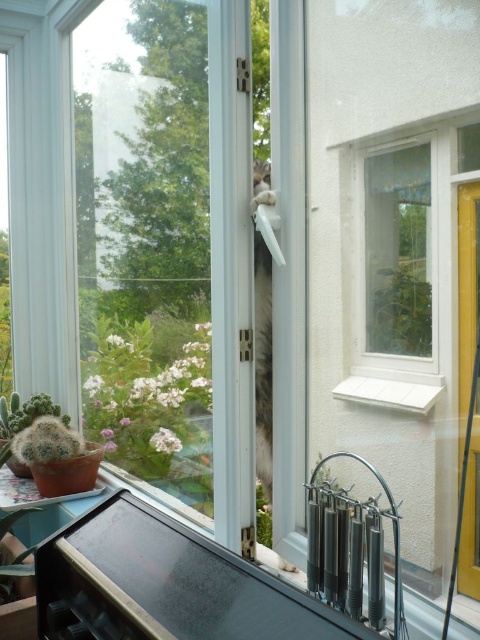
Question: Which point is farther to the camera?

Choices:
 (A) (2, 572)
 (B) (269, 509)

Answer: (B)

Question: From the image, what is the correct spatial relationship of yellow matte screen door at right in relation to green fuzzy cactus at lower left?

Choices:
 (A) below
 (B) above

Answer: (B)

Question: Which point appears closest to the camera in this image?

Choices:
 (A) tap(465, 572)
 (B) tap(17, 394)
 (C) tap(373, 300)

Answer: (A)

Question: Which of the following is the closest to the observer?

Choices:
 (A) green fuzzy cactus at lower left
 (B) green matte plant at lower center
 (C) yellow matte screen door at right
 (D) white matte window sill at lower center

Answer: (C)

Question: Can you confirm if green matte plant at left is thinner than green leafy plant at upper right?

Choices:
 (A) yes
 (B) no

Answer: (B)

Question: Can you confirm if green fuzzy cactus at lower left is wider than green matte cactus at lower left?

Choices:
 (A) no
 (B) yes

Answer: (B)